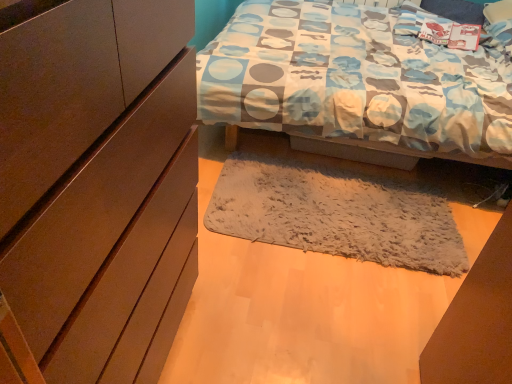
Question: Considering the positions of point (35, 51) and point (370, 206), is point (35, 51) closer or farther from the camera than point (370, 206)?

Choices:
 (A) closer
 (B) farther

Answer: (A)

Question: In the image, is matte brown cabinet at left on the left side or the right side of fuzzy gray mat at center?

Choices:
 (A) left
 (B) right

Answer: (A)

Question: From a real-world perspective, relative to fuzzy gray mat at center, is matte brown cabinet at left vertically above or below?

Choices:
 (A) above
 (B) below

Answer: (A)

Question: Is fuzzy gray mat at center in front of or behind matte brown cabinet at left in the image?

Choices:
 (A) behind
 (B) front

Answer: (A)

Question: Is fuzzy gray mat at center inside the boundaries of matte brown cabinet at left, or outside?

Choices:
 (A) inside
 (B) outside

Answer: (B)

Question: Visually, is fuzzy gray mat at center positioned to the left or to the right of matte brown cabinet at left?

Choices:
 (A) left
 (B) right

Answer: (B)

Question: From the image's perspective, is fuzzy gray mat at center above or below matte brown cabinet at left?

Choices:
 (A) below
 (B) above

Answer: (B)